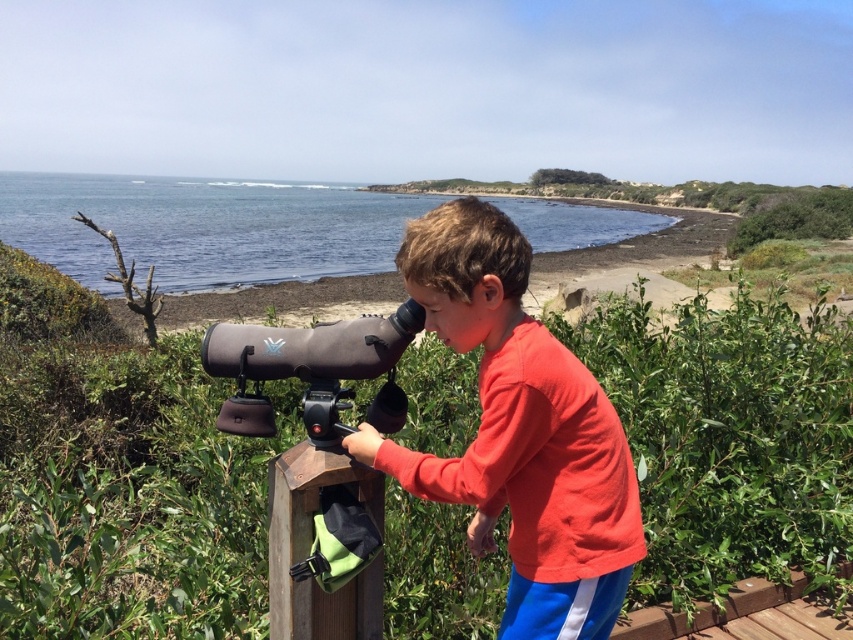
Question: Which of the following is the farthest from the observer?

Choices:
 (A) matte black telescope at center
 (B) matte red shirt at center

Answer: (A)

Question: Can you confirm if matte red shirt at center is smaller than matte black telescope at center?

Choices:
 (A) yes
 (B) no

Answer: (B)

Question: Does matte red shirt at center have a larger size compared to matte black telescope at center?

Choices:
 (A) no
 (B) yes

Answer: (B)

Question: Does matte red shirt at center have a larger size compared to matte black telescope at center?

Choices:
 (A) yes
 (B) no

Answer: (A)

Question: Among these points, which one is nearest to the camera?

Choices:
 (A) coord(292,369)
 (B) coord(576,451)

Answer: (B)

Question: Which point is farther from the camera taking this photo?

Choices:
 (A) (299, 337)
 (B) (556, 634)

Answer: (A)